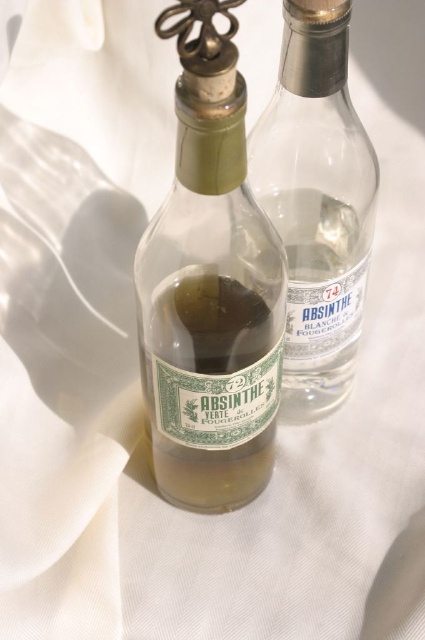
You are a bartender trying to grab the green glass absinthe bottle at center for a customer. However, there is another green glass absinthe at center in the way. Can you reach the bottle without moving the other object?

The green glass absinthe bottle at center is closer to the viewer than the green glass absinthe at center, so yes, you can reach the bottle without moving the other object since it is nearer.

From the picture: You are arranging bottles on a shelf and need to place them side by side. Given that the green glass absinthe bottle at center and the transparent glass absinthe bottle at center must be positioned according to their original arrangement, which bottle should be placed on the left side of the shelf?

The green glass absinthe bottle at center should be placed on the left side of the shelf because it is to the left of the transparent glass absinthe bottle at center in the original arrangement.

You are a bartender preparing a drink and have both the green glass absinthe bottle at center and the transparent glass absinthe bottle at center in front of you. Which bottle should you choose if you need a larger container for mixing ingredients?

The green glass absinthe bottle at center is larger in size than the transparent glass absinthe bottle at center, so you should choose the green glass absinthe bottle at center for a larger container.